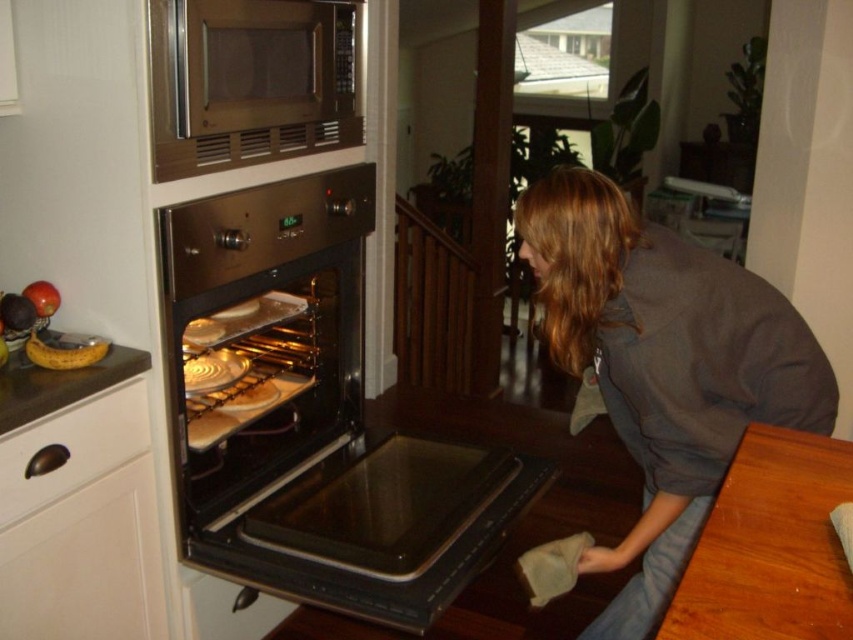
Question: Which object is closer to the camera taking this photo?

Choices:
 (A) dark gray sweatshirt at lower right
 (B) metallic silver microwave at upper center
 (C) stainless steel oven at center

Answer: (B)

Question: Does dark gray sweatshirt at lower right have a larger size compared to metallic silver microwave at upper center?

Choices:
 (A) no
 (B) yes

Answer: (B)

Question: Which point appears closest to the camera in this image?

Choices:
 (A) (30, 340)
 (B) (331, 125)
 (C) (248, 189)
 (D) (666, 508)

Answer: (D)

Question: Can you confirm if stainless steel oven at center is bigger than dark gray sweatshirt at lower right?

Choices:
 (A) no
 (B) yes

Answer: (B)

Question: Which point is closer to the camera taking this photo?

Choices:
 (A) (775, 397)
 (B) (32, 337)
 (C) (204, 54)

Answer: (A)

Question: Does metallic silver microwave at upper center have a larger size compared to yellow matte banana at left?

Choices:
 (A) yes
 (B) no

Answer: (A)